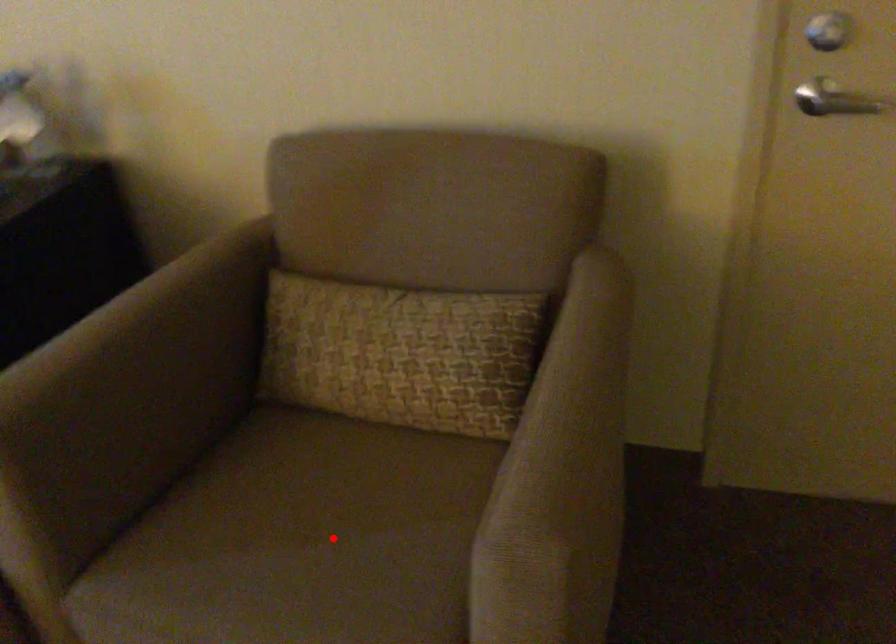
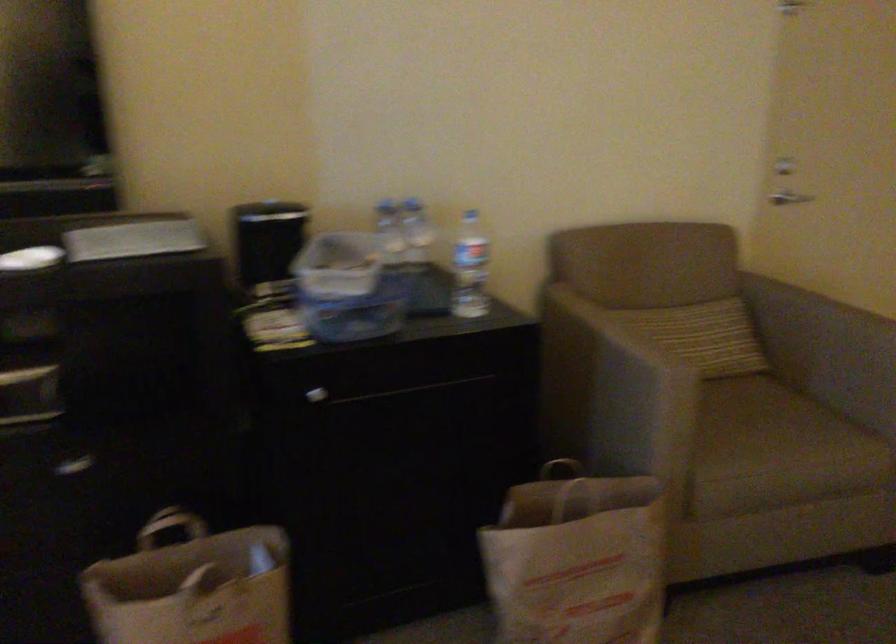
In the second image, find the point that corresponds to the highlighted location in the first image.

(762, 418)